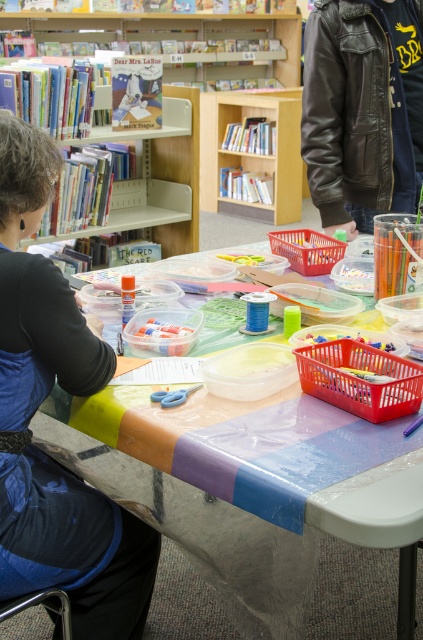
Between matte black shirt at left and leather jacket at upper right, which one is positioned lower?

matte black shirt at left is below.

Between matte black shirt at left and leather jacket at upper right, which one is positioned higher?

leather jacket at upper right is above.

What do you see at coordinates (36, 408) in the screenshot?
I see `matte black shirt at left` at bounding box center [36, 408].

Image resolution: width=423 pixels, height=640 pixels. In order to click on matte black shirt at left in this screenshot , I will do `click(36, 408)`.

Is translucent plastic table at center wider than light wood bookshelf at upper center?

Incorrect, translucent plastic table at center's width does not surpass light wood bookshelf at upper center's.

In the scene shown: Between translucent plastic table at center and light wood bookshelf at upper center, which one has more height?

Standing taller between the two is light wood bookshelf at upper center.

Describe the element at coordinates (233, 486) in the screenshot. I see `translucent plastic table at center` at that location.

Where is `translucent plastic table at center`? translucent plastic table at center is located at coordinates (233, 486).

Who is taller, leather jacket at upper right or wooden bookshelf at upper left?

With more height is leather jacket at upper right.

Does leather jacket at upper right appear on the right side of wooden bookshelf at upper left?

Correct, you'll find leather jacket at upper right to the right of wooden bookshelf at upper left.

Between point (359, 8) and point (195, 232), which one is positioned behind?

Positioned behind is point (195, 232).

What are the coordinates of `leather jacket at upper right` in the screenshot? It's located at point(362,108).